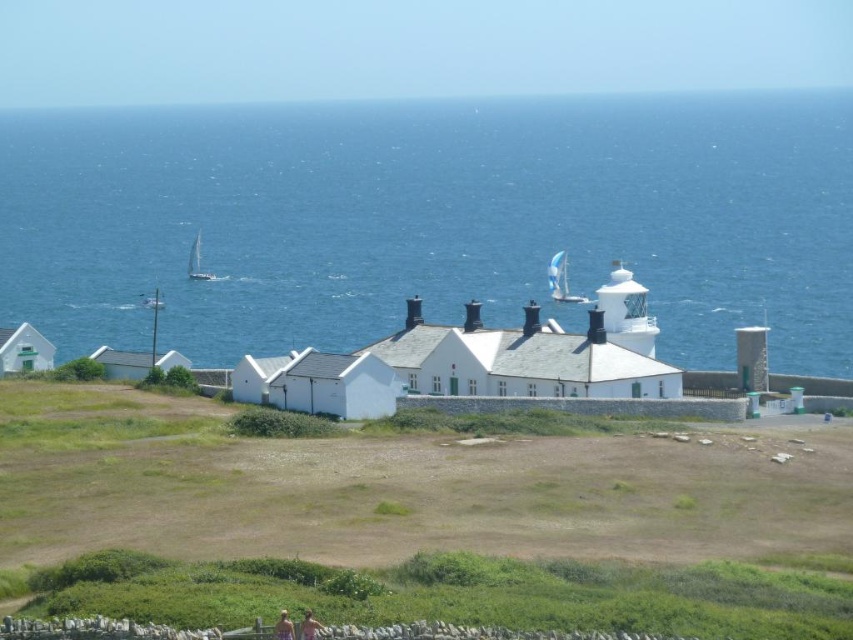
Question: Considering the relative positions of white sailboat at center and light brown hair at lower center in the image provided, where is white sailboat at center located with respect to light brown hair at lower center?

Choices:
 (A) right
 (B) left

Answer: (A)

Question: Can you confirm if white sailboat at center is positioned to the right of skinny jeans at lower center?

Choices:
 (A) yes
 (B) no

Answer: (A)

Question: From the image, what is the correct spatial relationship of white sailboat at center in relation to light brown hair at lower center?

Choices:
 (A) right
 (B) left

Answer: (A)

Question: Among these points, which one is nearest to the camera?

Choices:
 (A) (144, 298)
 (B) (310, 204)

Answer: (A)

Question: Which object appears closest to the camera in this image?

Choices:
 (A) light brown hair at lower center
 (B) blue water at center

Answer: (A)

Question: Estimate the real-world distances between objects in this image. Which object is farther from the skinny jeans at lower center?

Choices:
 (A) white sailboat at left
 (B) white plastic boat at left

Answer: (A)